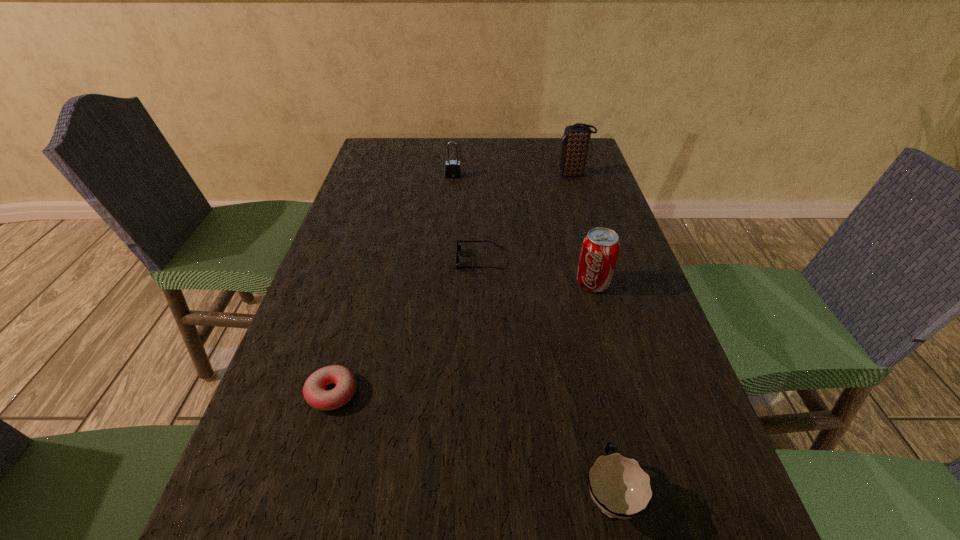
Find the location of a particular element. The height and width of the screenshot is (540, 960). vacant space situated 0.340m with the zip open on the clutch bag is located at coordinates (450, 174).

At what (x,y) coordinates should I click in order to perform the action: click on vacant space situated 0.290m on the front of the soda. Please return your answer as a coordinate pair (x, y). This screenshot has width=960, height=540. Looking at the image, I should click on (628, 409).

The image size is (960, 540). Identify the location of free space located on the shackle of the fourth shortest object. (451, 199).

At what (x,y) coordinates should I click in order to perform the action: click on vacant space situated 0.080m on the side of the third shortest object with the handle. Please return your answer as a coordinate pair (x, y). Looking at the image, I should click on (592, 415).

Locate an element on the screen. The height and width of the screenshot is (540, 960). free space located 0.310m on the side of the third shortest object with the handle is located at coordinates (572, 319).

The height and width of the screenshot is (540, 960). What are the coordinates of `free region located on the side of the third shortest object with the handle` in the screenshot? It's located at (568, 302).

Image resolution: width=960 pixels, height=540 pixels. Identify the location of vacant space situated on the front-facing side of the sunglasses. (396, 260).

This screenshot has width=960, height=540. In order to click on free space located on the front-facing side of the sunglasses in this screenshot , I will do `click(327, 260)`.

Identify the location of free region located 0.140m on the front-facing side of the sunglasses. Image resolution: width=960 pixels, height=540 pixels. (400, 260).

Locate an element on the screen. The image size is (960, 540). free space located 0.060m on the left of the fifth farthest object is located at coordinates (274, 393).